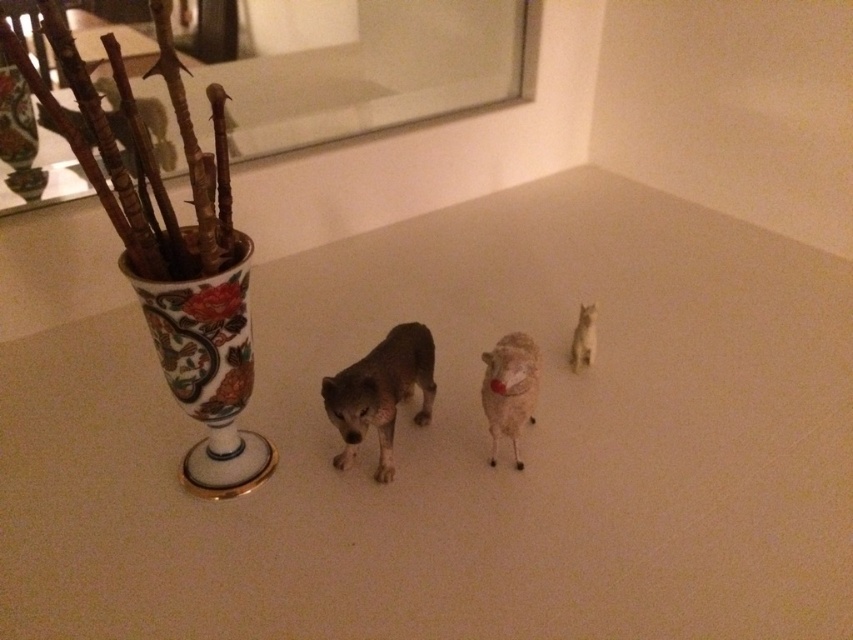
You are organizing items on a table and need to place a new item between the porcelain vase at left and the wolf figurine. Can you determine the direction you should move from the vase to reach the wolf figurine?

The wolf figurine is to the right of the porcelain vase at left, so you should move to the right from the vase to reach it.

You are arranging a display on a table with a tall ornate vase on the left. You have a white matte sheep at center and a white fur cat at right. From the perspective of someone looking at the table, which animal figurine is positioned lower on the table?

The white matte sheep at center is located below the white fur cat at right, so the white matte sheep at center is positioned lower on the table.